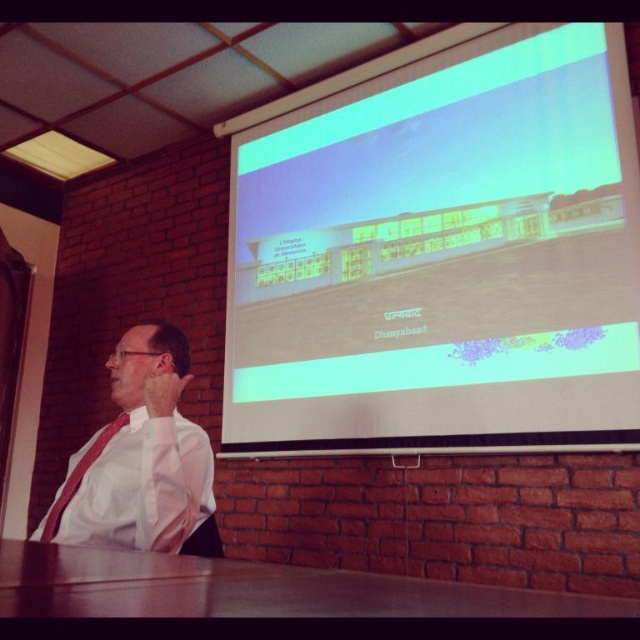
Question: Does matte plastic projector screen at upper center have a larger size compared to white shirt at left?

Choices:
 (A) no
 (B) yes

Answer: (B)

Question: Which object appears farthest from the camera in this image?

Choices:
 (A) matte plastic projector screen at upper center
 (B) matte red tie at left
 (C) white shirt at left
 (D) brown wooden table at lower center

Answer: (A)

Question: Does brown wooden table at lower center have a smaller size compared to white shirt at left?

Choices:
 (A) no
 (B) yes

Answer: (A)

Question: Which point appears farthest from the camera in this image?

Choices:
 (A) (138, 508)
 (B) (115, 426)

Answer: (B)

Question: Which object is positioned closest to the matte red tie at left?

Choices:
 (A) matte plastic projector screen at upper center
 (B) white shirt at left

Answer: (B)

Question: In this image, where is brown wooden table at lower center located relative to matte red tie at left?

Choices:
 (A) left
 (B) right

Answer: (B)